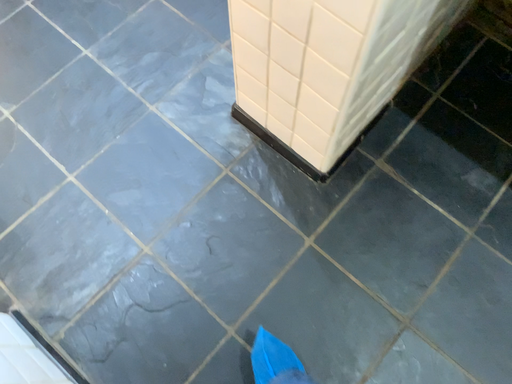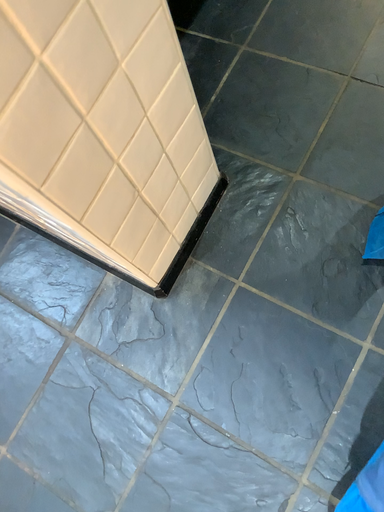
Question: How did the camera likely rotate when shooting the video?

Choices:
 (A) rotated right
 (B) rotated left

Answer: (A)